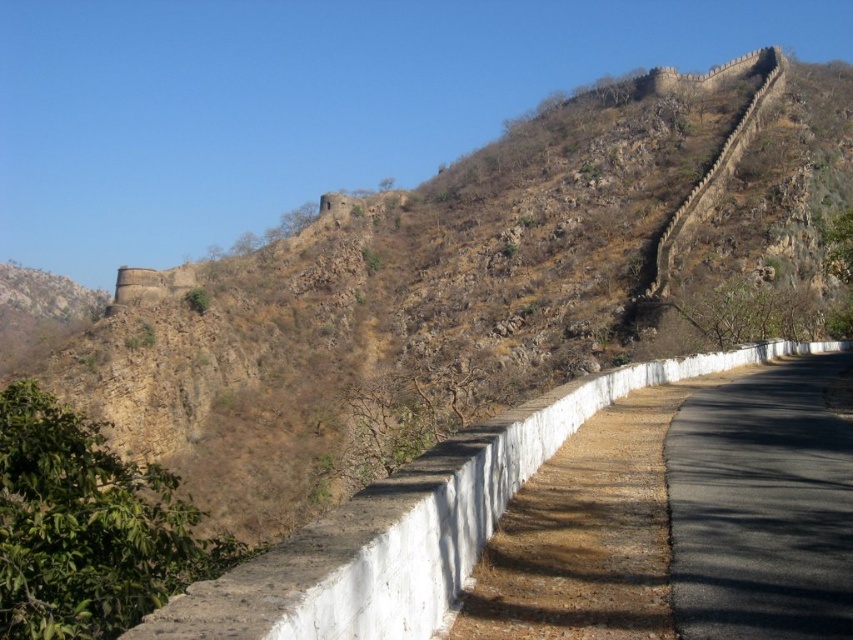
You are standing at the base of the hill near the ancient fortification. You see two points marked on the map. The first point is at coordinate point (293, 596) and the second point is at coordinate point (807, 513). Which point is closer to you?

Point (293, 596) is in front of point (807, 513), so it is closer to you.

You are a hiker planning to take a photo of the white stone wall at center and the black asphalt road at center from a distance. Which object will appear bigger in your photo?

The white stone wall at center will appear bigger in the photo because it has a larger size compared to the black asphalt road at center.

You are standing at the base of the hill where the rugged, arid landscape is dominated by the ancient fortification. You want to reach the white stone wall at center. Which direction should you move to get closer to it?

The white stone wall at center is located at point (415, 524), so you should move towards the center of the image to reach it.